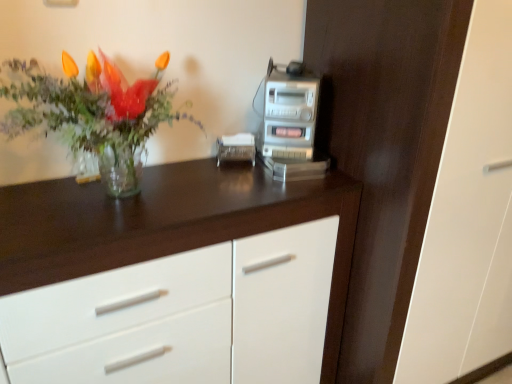
Image resolution: width=512 pixels, height=384 pixels. Identify the location of free space in front of silver metallic stereo at upper right. (272, 187).